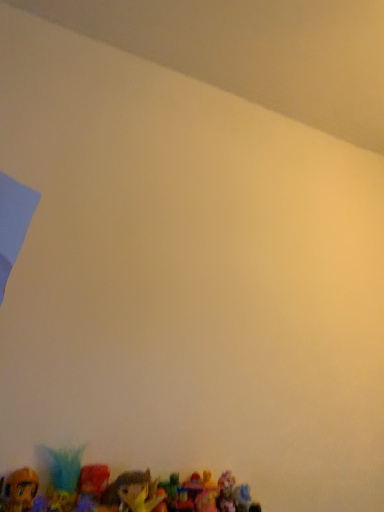
Question: From the image's perspective, is plush toy at bottom, which is counted as the 2th toy, starting from the left, beneath shiny plastic toy at lower left, the 3th toy viewed from the right?

Choices:
 (A) no
 (B) yes

Answer: (B)

Question: From a real-world perspective, is plush toy at bottom, which is counted as the 2th toy, starting from the left, on top of shiny plastic toy at lower left, the 1th toy positioned from the left?

Choices:
 (A) no
 (B) yes

Answer: (B)

Question: Is plush toy at bottom, which is counted as the 2th toy, starting from the left, taller than shiny plastic toy at lower left, the 3th toy viewed from the right?

Choices:
 (A) no
 (B) yes

Answer: (B)

Question: Considering the relative sizes of plush toy at bottom, which is counted as the 2th toy, starting from the left, and shiny plastic toy at lower left, the 1th toy positioned from the left, in the image provided, is plush toy at bottom, which is counted as the 2th toy, starting from the left, wider than shiny plastic toy at lower left, the 1th toy positioned from the left,?

Choices:
 (A) no
 (B) yes

Answer: (B)

Question: From the image's perspective, is plush toy at bottom, which is counted as the 2th toy, starting from the left, on shiny plastic toy at lower left, the 1th toy positioned from the left?

Choices:
 (A) yes
 (B) no

Answer: (B)

Question: From a real-world perspective, is shiny plastic toy at lower center, marked as the first toy in a right-to-left arrangement, physically located above or below shiny plastic toy at lower left, the 3th toy viewed from the right?

Choices:
 (A) below
 (B) above

Answer: (A)

Question: Is point (102, 503) closer or farther from the camera than point (6, 482)?

Choices:
 (A) closer
 (B) farther

Answer: (B)

Question: Looking at the image, does shiny plastic toy at lower center, marked as the first toy in a right-to-left arrangement, seem bigger or smaller compared to shiny plastic toy at lower left, the 1th toy positioned from the left?

Choices:
 (A) small
 (B) big

Answer: (B)

Question: In the image, is shiny plastic toy at lower center, marked as the first toy in a right-to-left arrangement, on the left side or the right side of shiny plastic toy at lower left, the 3th toy viewed from the right?

Choices:
 (A) left
 (B) right

Answer: (B)

Question: Which is correct: shiny plastic toy at lower center, marked as the first toy in a right-to-left arrangement, is inside plush toy at bottom, the second toy viewed from the right, or outside of it?

Choices:
 (A) outside
 (B) inside

Answer: (A)

Question: In the image, is shiny plastic toy at lower center, marked as the first toy in a right-to-left arrangement, on the left side or the right side of plush toy at bottom, the second toy viewed from the right?

Choices:
 (A) left
 (B) right

Answer: (B)

Question: In terms of size, does shiny plastic toy at lower center, which is counted as the 3th toy, starting from the left, appear bigger or smaller than plush toy at bottom, which is counted as the 2th toy, starting from the left?

Choices:
 (A) big
 (B) small

Answer: (B)

Question: Relative to plush toy at bottom, which is counted as the 2th toy, starting from the left, is shiny plastic toy at lower center, which is counted as the 3th toy, starting from the left, in front or behind?

Choices:
 (A) behind
 (B) front

Answer: (B)

Question: In terms of height, does plush toy at bottom, the second toy viewed from the right, look taller or shorter compared to shiny plastic toy at lower center, marked as the first toy in a right-to-left arrangement?

Choices:
 (A) short
 (B) tall

Answer: (B)

Question: From the image's perspective, relative to shiny plastic toy at lower center, marked as the first toy in a right-to-left arrangement, is plush toy at bottom, which is counted as the 2th toy, starting from the left, above or below?

Choices:
 (A) above
 (B) below

Answer: (A)